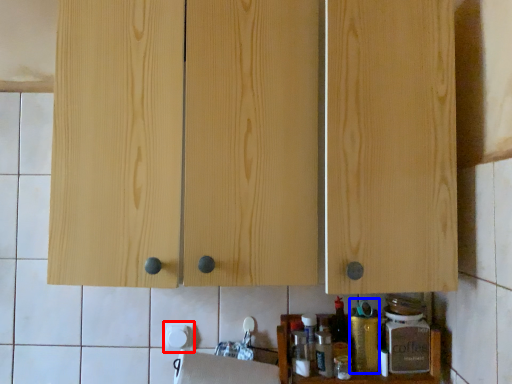
Question: Which of the following is the farthest to the observer, paper towel (highlighted by a red box) or bottle (highlighted by a blue box)?

Choices:
 (A) paper towel
 (B) bottle

Answer: (A)